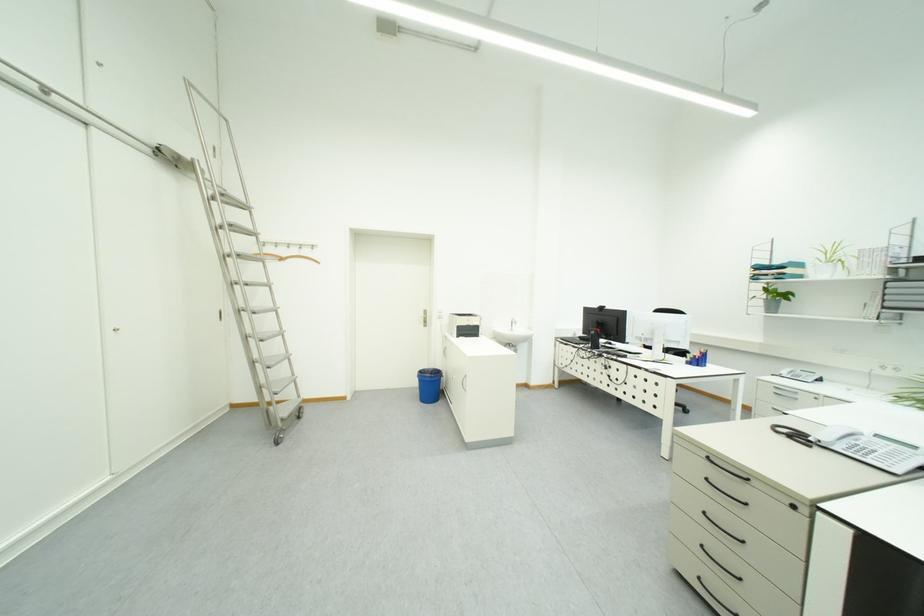
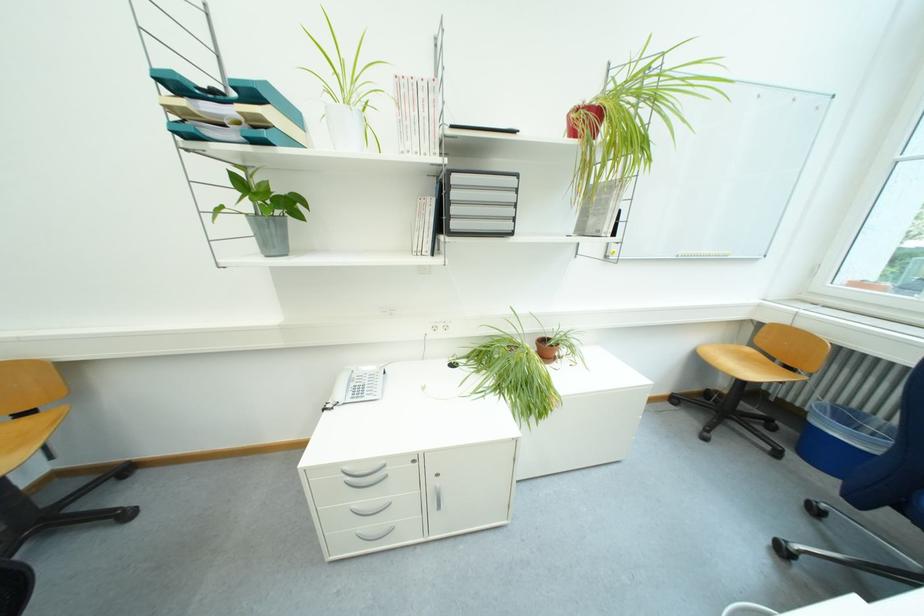
The point at (797, 297) is marked in the first image. Where is the corresponding point in the second image?

(302, 206)